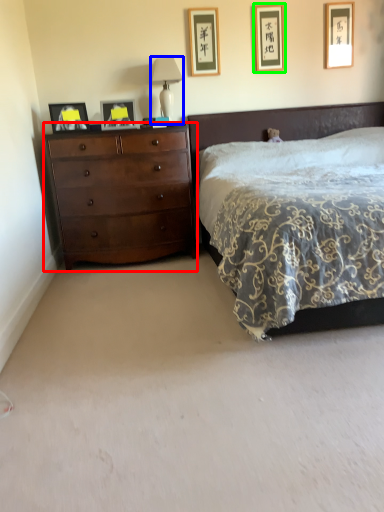
Question: Based on their relative distances, which object is farther from chest of drawers (highlighted by a red box)? Choose from table lamp (highlighted by a blue box) and picture frame (highlighted by a green box).

Choices:
 (A) table lamp
 (B) picture frame

Answer: (B)